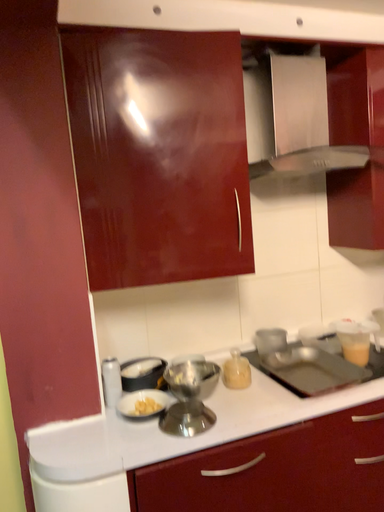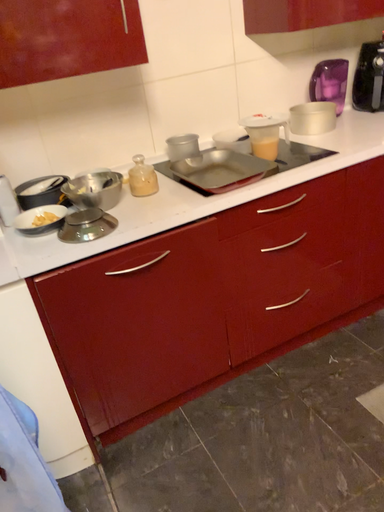
Question: How did the camera likely rotate when shooting the video?

Choices:
 (A) rotated downward
 (B) rotated upward

Answer: (A)